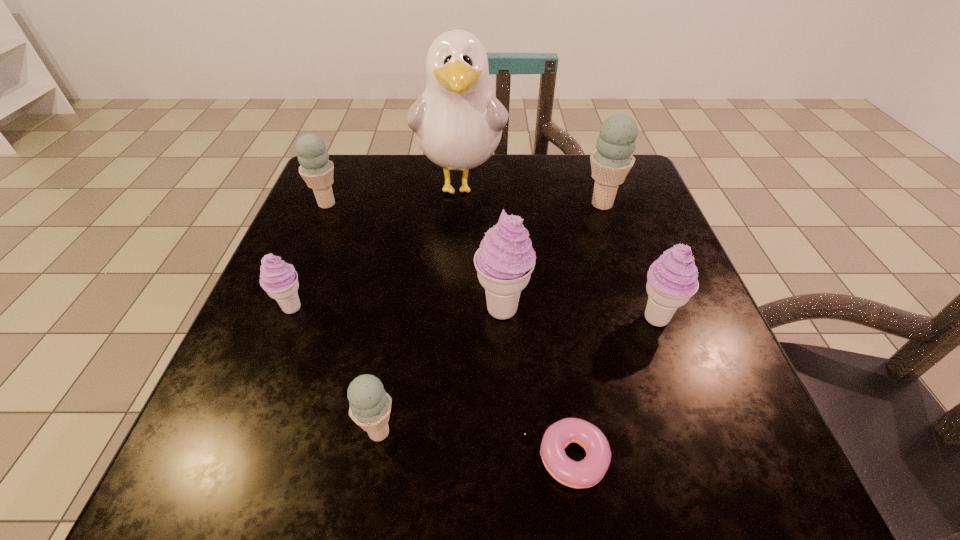
Where is `white gull`? white gull is located at coordinates (458, 122).

Where is `the tallest object`? This screenshot has width=960, height=540. the tallest object is located at coordinates (458, 122).

At what (x,y) coordinates should I click in order to perform the action: click on the rightmost blue ice cream. Please return your answer as a coordinate pair (x, y). Image resolution: width=960 pixels, height=540 pixels. Looking at the image, I should click on (612, 160).

What are the coordinates of `the second purple icecream from left to right` in the screenshot? It's located at (504, 262).

Find the location of a particular element. The height and width of the screenshot is (540, 960). the biggest purple icecream is located at coordinates (504, 262).

What are the coordinates of `the second biggest blue ice cream` in the screenshot? It's located at tap(316, 169).

The height and width of the screenshot is (540, 960). I want to click on the rightmost purple icecream, so (x=672, y=279).

I want to click on the leftmost purple icecream, so click(x=280, y=280).

The height and width of the screenshot is (540, 960). I want to click on the nearest blue ice cream, so click(x=370, y=405).

Image resolution: width=960 pixels, height=540 pixels. I want to click on the fourth ice cream from right to left, so click(370, 405).